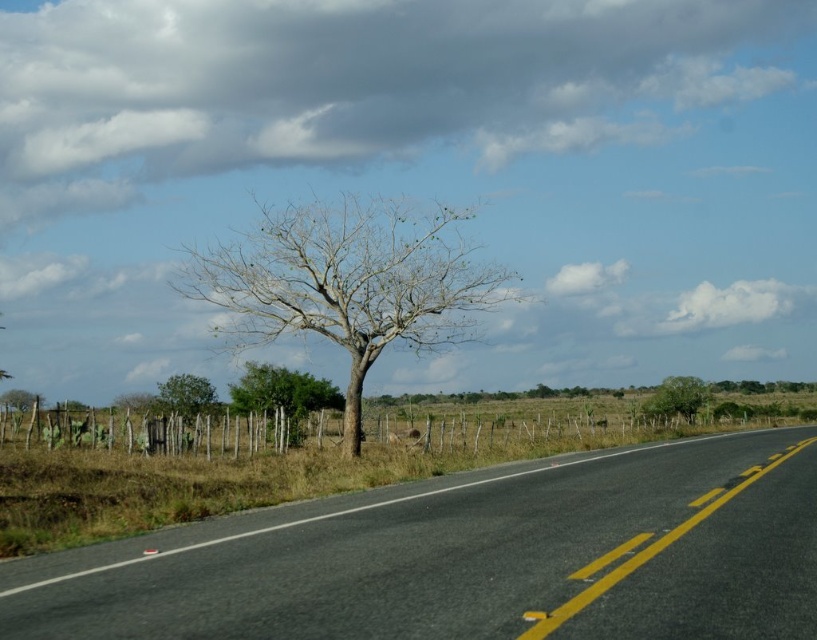
Is black asphalt road at center to the left of bare wood tree at center from the viewer's perspective?

Incorrect, black asphalt road at center is not on the left side of bare wood tree at center.

Between black asphalt road at center and bare wood tree at center, which one appears on the left side from the viewer's perspective?

bare wood tree at center is more to the left.

Between point (775, 440) and point (257, 243), which one is positioned behind?

The point (257, 243) is behind.

The width and height of the screenshot is (817, 640). I want to click on black asphalt road at center, so click(471, 557).

Does point (672, 403) lie behind point (19, 388)?

No, (672, 403) is closer to viewer.

What do you see at coordinates (676, 397) in the screenshot?
I see `green leafy tree at right` at bounding box center [676, 397].

At what (x,y) coordinates should I click in order to perform the action: click on green leafy tree at right. Please return your answer as a coordinate pair (x, y). Looking at the image, I should click on (676, 397).

Does black asphalt road at center appear on the right side of bare wood tree at left?

Correct, you'll find black asphalt road at center to the right of bare wood tree at left.

Between black asphalt road at center and bare wood tree at left, which one is positioned lower?

Positioned lower is bare wood tree at left.

Locate an element on the screen. black asphalt road at center is located at coordinates (471, 557).

Find the location of `black asphalt road at center`. black asphalt road at center is located at coordinates 471,557.